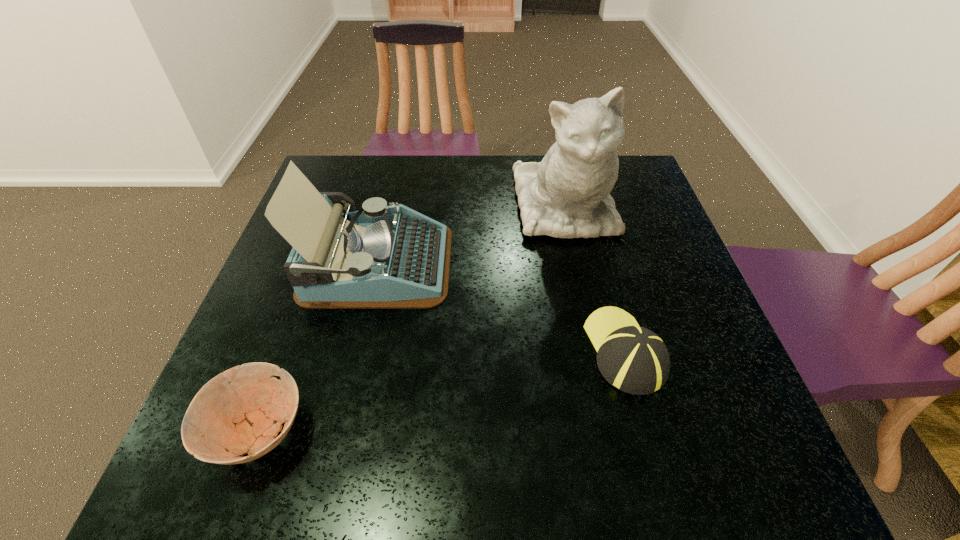
Find the location of a particular element. free spot at the far left corner of the desktop is located at coordinates (372, 160).

Locate an element on the screen. The image size is (960, 540). free space between the baseball cap and the typewriter is located at coordinates click(501, 307).

I want to click on empty space between the tallest object and the bowl, so click(411, 319).

The image size is (960, 540). I want to click on vacant area between the baseball cap and the tallest object, so click(595, 279).

Find the location of a particular element. This screenshot has width=960, height=540. empty location between the typewriter and the bowl is located at coordinates (318, 347).

The width and height of the screenshot is (960, 540). I want to click on unoccupied area between the baseball cap and the second tallest object, so 501,307.

This screenshot has width=960, height=540. What are the coordinates of `free space between the baseball cap and the cat` in the screenshot? It's located at (595, 279).

The height and width of the screenshot is (540, 960). I want to click on vacant area between the bowl and the baseball cap, so click(x=441, y=390).

This screenshot has height=540, width=960. In order to click on free space between the bowl and the typewriter in this screenshot , I will do `click(318, 347)`.

Where is `empty space between the baseball cap and the bowl`? empty space between the baseball cap and the bowl is located at coordinates (441, 390).